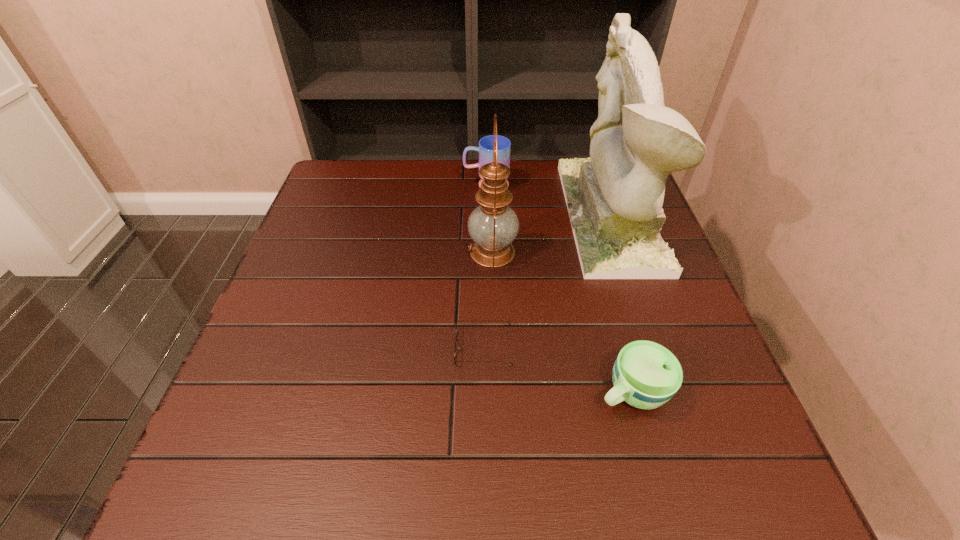
The image size is (960, 540). What are the coordinates of `vacant region located 0.140m on the side of the third tallest object with the handle` in the screenshot? It's located at (417, 185).

Locate an element on the screen. The image size is (960, 540). vacant space located 0.380m on the side of the third tallest object with the handle is located at coordinates (335, 185).

Identify the location of free space located on the back of the cup. (604, 288).

What are the coordinates of `vacant point located on the front-facing side of the shortest object` in the screenshot? It's located at [x=347, y=348].

What are the coordinates of `blank space located on the front-facing side of the shortest object` in the screenshot? It's located at (392, 348).

You are a GUI agent. You are given a task and a screenshot of the screen. Output one action in this format:
    pyautogui.click(x=<x>, y=<y>)
    Task: Click on the vacant space located on the front-facing side of the shortest object
    The image size is (960, 540).
    Given the screenshot: What is the action you would take?
    pyautogui.click(x=327, y=348)

Locate an element on the screen. Image resolution: width=960 pixels, height=540 pixels. sculpture located in the far edge section of the desktop is located at coordinates (614, 199).

The width and height of the screenshot is (960, 540). I want to click on mug that is at the far edge, so click(485, 149).

In order to click on sculpture present at the right edge in this screenshot , I will do `click(614, 199)`.

The image size is (960, 540). I want to click on cup at the right edge, so click(646, 375).